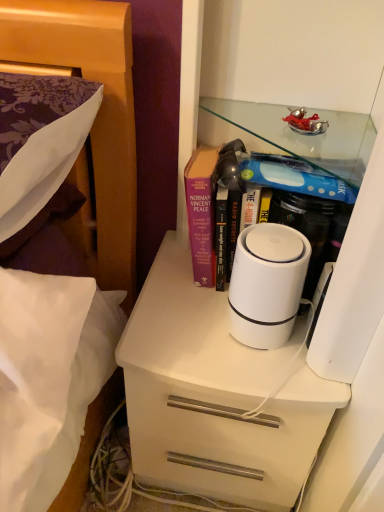
Question: Is white glossy cabinet at center inside or outside of hardcover book at center?

Choices:
 (A) outside
 (B) inside

Answer: (A)

Question: In terms of width, does white glossy cabinet at center look wider or thinner when compared to hardcover book at center?

Choices:
 (A) wide
 (B) thin

Answer: (A)

Question: Which object is the farthest from the white glossy cabinet at center?

Choices:
 (A) hardcover book at center
 (B) white matte cylindrical device at center
 (C) white matte chest of drawers at center

Answer: (C)

Question: Which of these objects is positioned closest to the white matte cylindrical device at center?

Choices:
 (A) hardcover book at center
 (B) white matte chest of drawers at center
 (C) white glossy cabinet at center

Answer: (A)